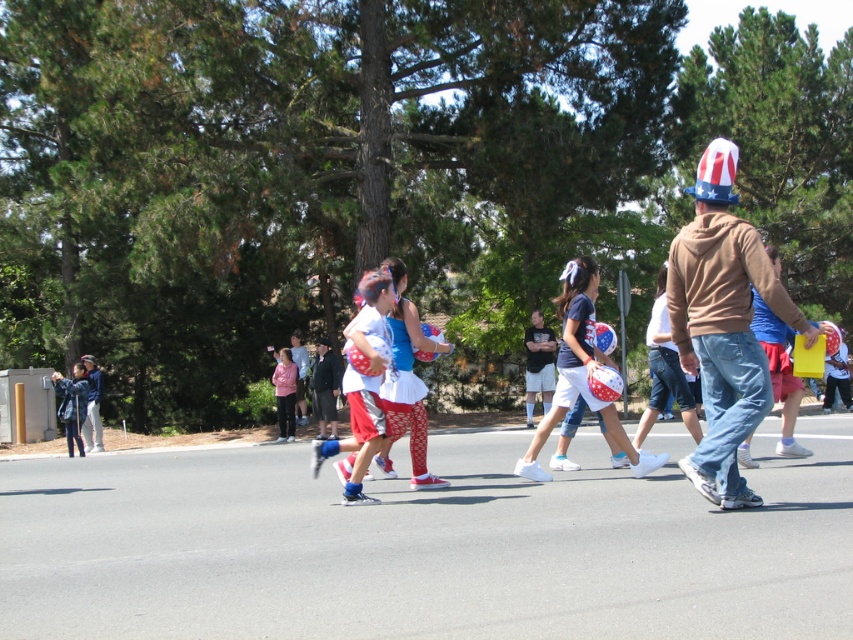
Question: Is brown hoodie at center bigger than matte red helmet at center?

Choices:
 (A) yes
 (B) no

Answer: (B)

Question: Does brown hoodie at center have a larger size compared to matte red helmet at center?

Choices:
 (A) yes
 (B) no

Answer: (B)

Question: Which point appears closest to the camera in this image?

Choices:
 (A) (363, 376)
 (B) (790, 312)

Answer: (B)

Question: Among these objects, which one is farthest from the camera?

Choices:
 (A) matte red helmet at center
 (B) brown hoodie at center

Answer: (A)

Question: Is brown hoodie at center above matte red helmet at center?

Choices:
 (A) yes
 (B) no

Answer: (B)

Question: Which of the following is the farthest from the observer?

Choices:
 (A) matte red helmet at center
 (B) brown hoodie at center

Answer: (A)